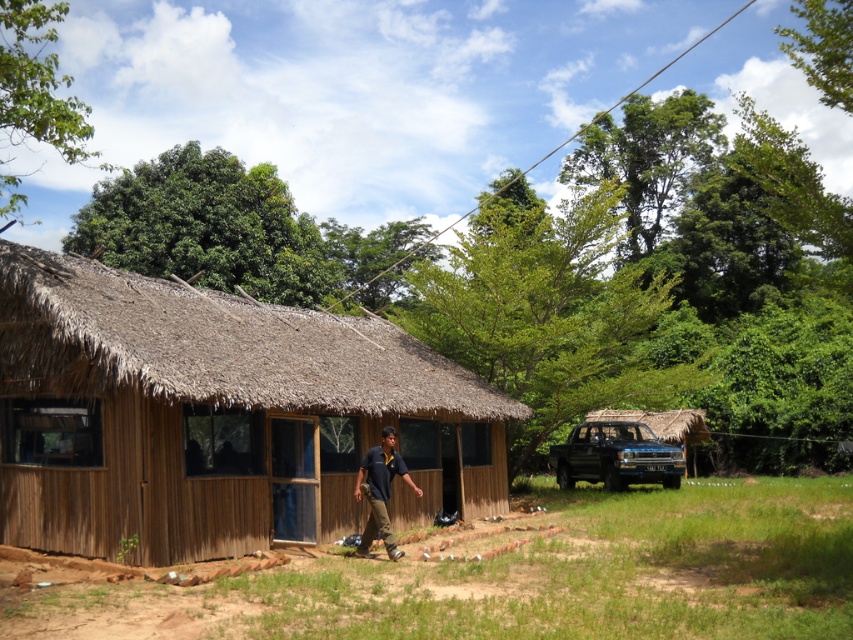
Which is more to the left, black matte jeep at center or dark brown uniform at center?

dark brown uniform at center

Does black matte jeep at center have a lesser width compared to dark brown uniform at center?

No, black matte jeep at center is not thinner than dark brown uniform at center.

Which is in front, point (578, 449) or point (384, 502)?

Positioned in front is point (384, 502).

The height and width of the screenshot is (640, 853). Identify the location of black matte jeep at center. (614, 456).

Is dark brown uniform at center wider than thatched straw hut at right?

In fact, dark brown uniform at center might be narrower than thatched straw hut at right.

Which is in front, point (376, 460) or point (682, 419)?

Point (376, 460)

Find the location of a particular element. The height and width of the screenshot is (640, 853). dark brown uniform at center is located at coordinates (380, 492).

Image resolution: width=853 pixels, height=640 pixels. Identify the location of dark brown uniform at center. (380, 492).

Can you confirm if black matte jeep at center is thinner than thatched straw hut at right?

Correct, black matte jeep at center's width is less than thatched straw hut at right's.

Is black matte jeep at center behind thatched straw hut at right?

Result: No, it is in front of thatched straw hut at right.

Who is more distant from viewer, (606, 467) or (683, 426)?

Positioned behind is point (683, 426).

Where is `black matte jeep at center`? The image size is (853, 640). black matte jeep at center is located at coordinates (614, 456).